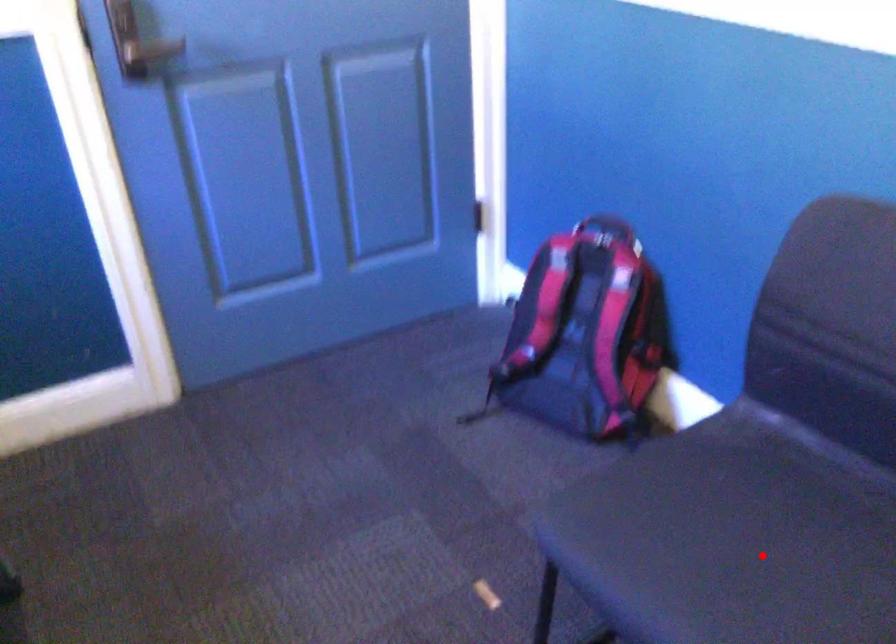
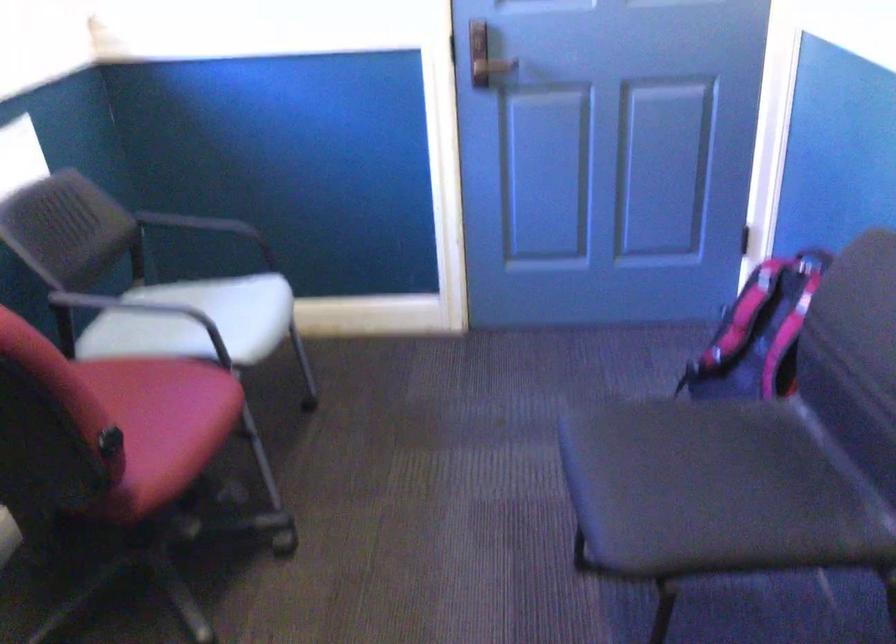
The point at the highlighted location is marked in the first image. Where is the corresponding point in the second image?

(698, 485)